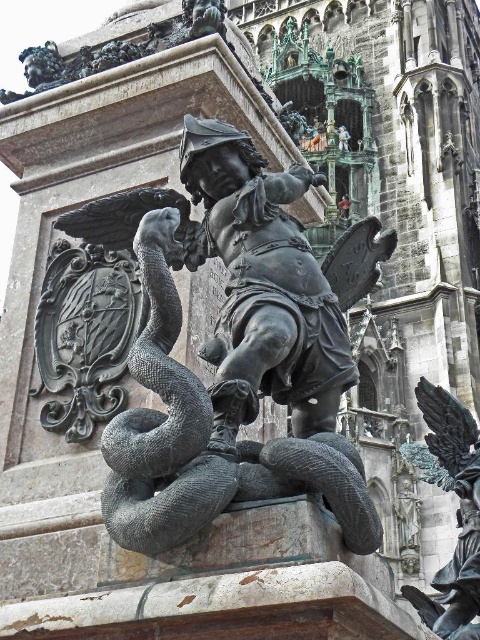
What are the coordinates of `polished bronze snake at center` in the screenshot? It's located at (206, 442).

Between polished bronze snake at center and polished bronze eagle at center, which one is positioned lower?

polished bronze eagle at center is below.

Locate an element on the screen. polished bronze snake at center is located at coordinates (206, 442).